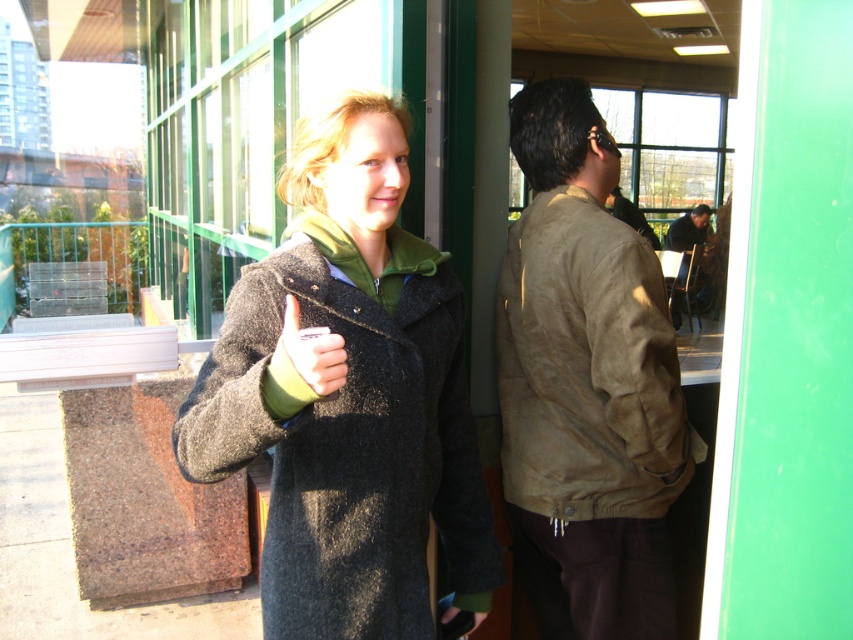
You are standing at the entrance of the building and want to determine which of the two points, point (403, 192) or point (693, 461), is nearer to you. Based on the scene description, which point is closer?

Point (403, 192) is closer to the viewer than point (693, 461).